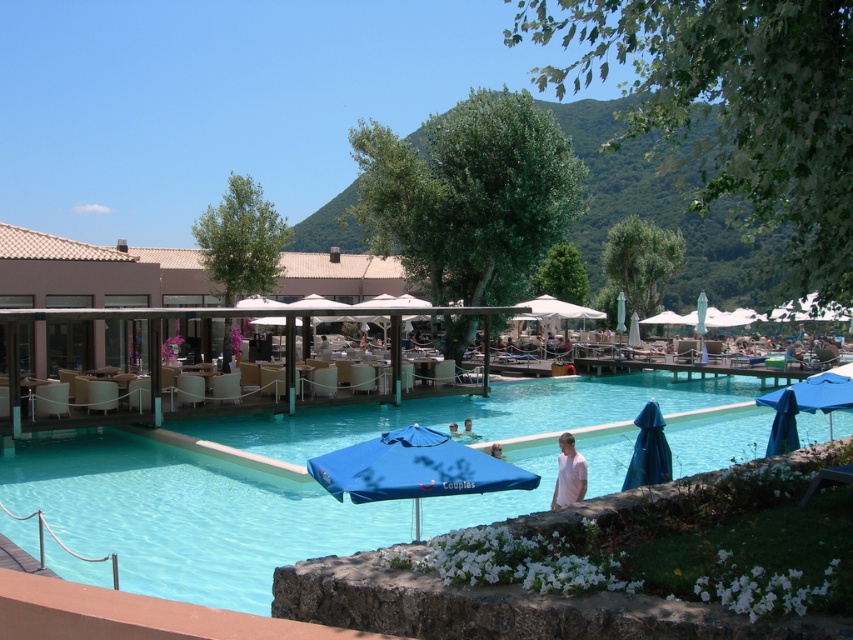
Question: Which object appears farthest from the camera in this image?

Choices:
 (A) blue fabric umbrella at lower center
 (B) matte beige patio furniture at center

Answer: (B)

Question: Is blue glossy pool at center below smooth skin person at lower center?

Choices:
 (A) no
 (B) yes

Answer: (B)

Question: Can you confirm if blue fabric umbrella at lower right is bigger than white cotton shirt at lower center?

Choices:
 (A) yes
 (B) no

Answer: (A)

Question: Estimate the real-world distances between objects in this image. Which object is farther from the blue fabric umbrella at lower right?

Choices:
 (A) blue glossy pool at center
 (B) matte beige patio furniture at center
 (C) white cotton shirt at lower center
 (D) light blue fabric umbrella at center

Answer: (B)

Question: Which of the following is the closest to the observer?

Choices:
 (A) white cotton shirt at lower center
 (B) blue fabric umbrella at lower center
 (C) smooth skin person at lower center
 (D) matte beige patio furniture at center

Answer: (B)

Question: Does blue fabric umbrella at lower right appear over smooth skin person at lower center?

Choices:
 (A) no
 (B) yes

Answer: (B)